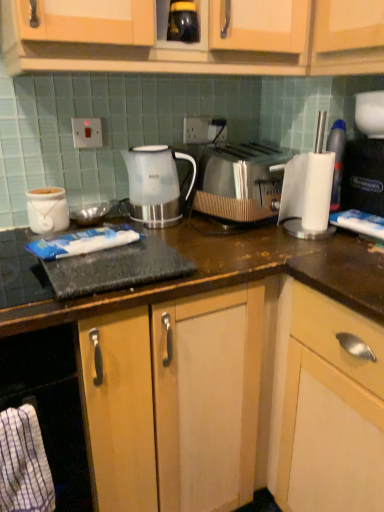
Locate an element on the screen. The image size is (384, 512). vacant space in front of translucent plastic kettle at center is located at coordinates (181, 233).